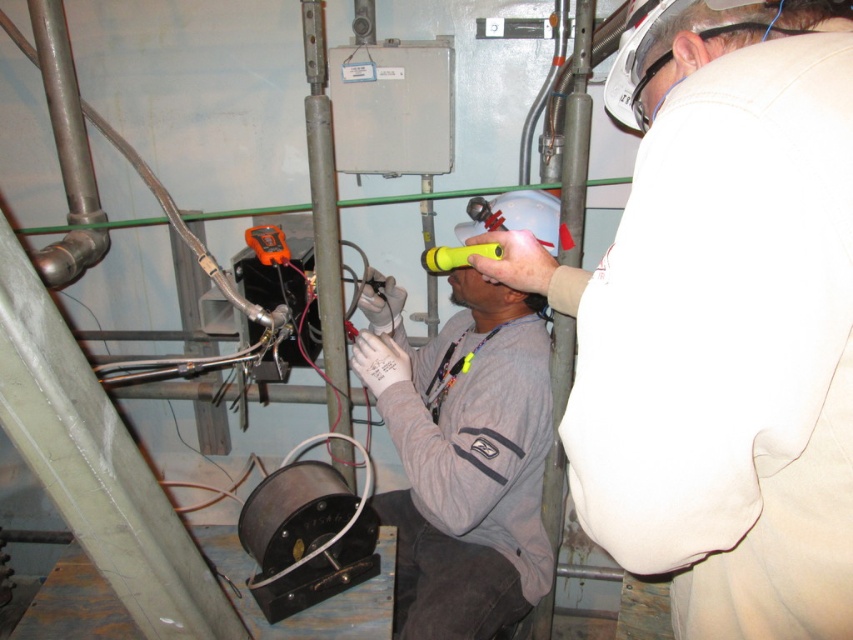
You are a safety inspector in this industrial workspace. You need to ensure that the white matte helmet at upper center and the gray matte shirt at center are properly positioned according to safety protocols. Based on their current positions, which object takes up more space in the image?

The gray matte shirt at center occupies more space than the white matte helmet at upper center, so the gray matte shirt at center takes up more space in the image.